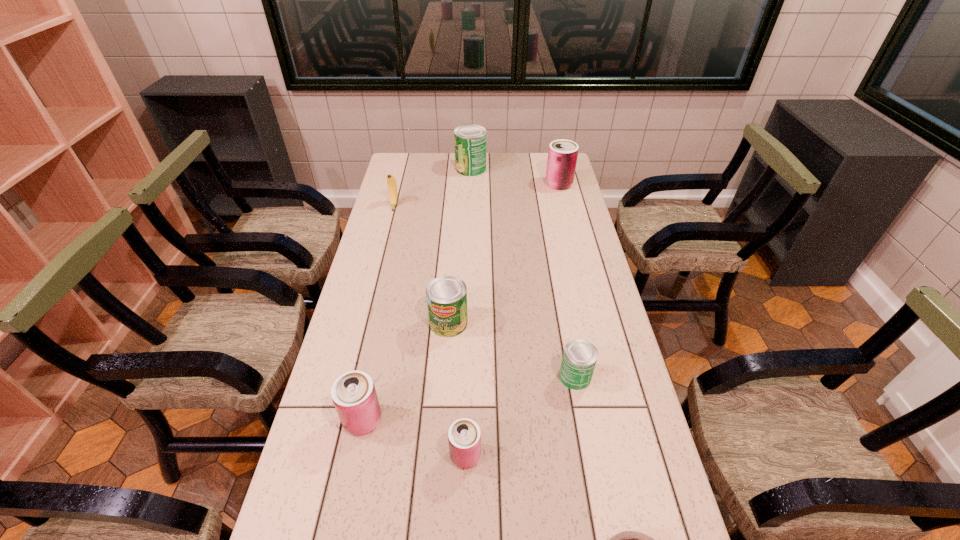
I want to click on vacant area that lies between the smallest green can and the second pink can from left to right, so click(520, 416).

This screenshot has height=540, width=960. Identify the location of vacant area that lies between the biggest green can and the leftmost can. pyautogui.click(x=417, y=294).

Locate an element on the screen. The image size is (960, 540). vacant space that's between the leftmost pink can and the farthest object is located at coordinates (417, 294).

Where is `object that can be found as the seventh closest to the banana`? object that can be found as the seventh closest to the banana is located at coordinates (627, 539).

You are a GUI agent. You are given a task and a screenshot of the screen. Output one action in this format:
    pyautogui.click(x=<x>, y=<y>)
    Task: Click on the object that is the seventh closest one to the sixth nearest object
    This screenshot has width=960, height=540.
    Given the screenshot: What is the action you would take?
    pyautogui.click(x=627, y=539)

The height and width of the screenshot is (540, 960). I want to click on the fourth closest can to the biggest green can, so click(x=353, y=393).

Select which can is the second closest to the fourth farthest can. Please provide its 2D coordinates. Your answer should be formatted as a tuple, i.e. [(x, y)], where the tuple contains the x and y coordinates of a point satisfying the conditions above.

[(446, 296)]

I want to click on the second closest green can relative to the second pink can from right to left, so click(446, 296).

Point out which green can is positioned as the second nearest to the second farthest can. Please provide its 2D coordinates. Your answer should be formatted as a tuple, i.e. [(x, y)], where the tuple contains the x and y coordinates of a point satisfying the conditions above.

[(446, 296)]

Select which pink can is the second closest to the shortest object. Please provide its 2D coordinates. Your answer should be formatted as a tuple, i.e. [(x, y)], where the tuple contains the x and y coordinates of a point satisfying the conditions above.

[(353, 393)]